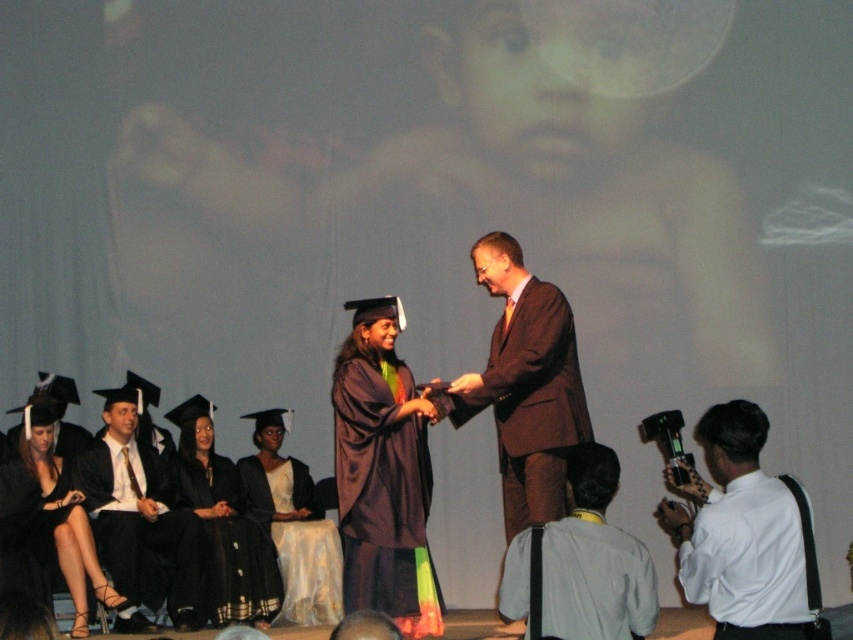
Describe the element at coordinates (595, 561) in the screenshot. I see `gray fabric camera at lower right` at that location.

Which is behind, point (514, 556) or point (99, 528)?

The point (99, 528) is more distant.

Where is `gray fabric camera at lower right`? gray fabric camera at lower right is located at coordinates (595, 561).

Can you confirm if white shirt at lower right is smaller than brown suit at center?

Yes.

The width and height of the screenshot is (853, 640). Describe the element at coordinates (740, 534) in the screenshot. I see `white shirt at lower right` at that location.

Which is in front, point (735, 563) or point (485, 381)?

Point (735, 563) is more forward.

Locate an element on the screen. This screenshot has height=640, width=853. white shirt at lower right is located at coordinates (740, 534).

Is white shirt at lower right bigger than gray fabric camera at lower right?

Actually, white shirt at lower right might be smaller than gray fabric camera at lower right.

Who is positioned more to the left, white shirt at lower right or gray fabric camera at lower right?

gray fabric camera at lower right is more to the left.

Is point (729, 435) closer to viewer compared to point (527, 588)?

That is True.

Image resolution: width=853 pixels, height=640 pixels. Identify the location of white shirt at lower right. (740, 534).